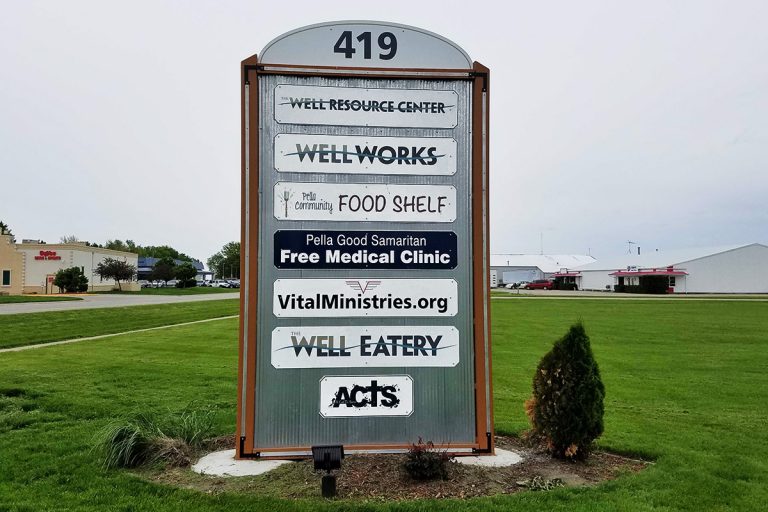
Where is `brown frame on left and right side`? This screenshot has height=512, width=768. brown frame on left and right side is located at coordinates (480, 302), (247, 296).